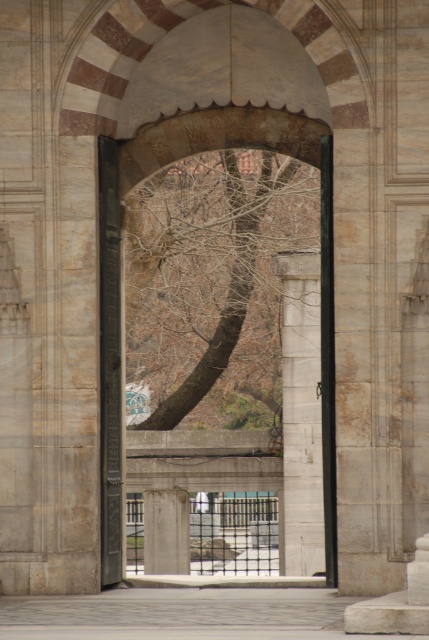
Can you confirm if bare wood tree at center is taller than white stone pillar at center?

Incorrect, bare wood tree at center's height is not larger of white stone pillar at center's.

Based on the photo, between bare wood tree at center and white stone pillar at center, which one has less height?

bare wood tree at center is shorter.

Is point (172, 243) less distant than point (313, 465)?

No, (172, 243) is behind (313, 465).

Where is `bare wood tree at center`? The image size is (429, 640). bare wood tree at center is located at coordinates (211, 275).

Is white stone pillar at center closer to camera compared to white marble pillar at center?

Yes, white stone pillar at center is in front of white marble pillar at center.

Is white stone pillar at center bigger than white marble pillar at center?

Correct, white stone pillar at center is larger in size than white marble pillar at center.

Which is in front, point (304, 296) or point (166, 506)?

Point (304, 296) is more forward.

At what (x,y) coordinates should I click in order to perform the action: click on white stone pillar at center. Please return your answer as a coordinate pair (x, y). The height and width of the screenshot is (640, 429). Looking at the image, I should click on (301, 413).

Does bare wood tree at center have a lesser width compared to white marble pillar at center?

In fact, bare wood tree at center might be wider than white marble pillar at center.

Is bare wood tree at center shorter than white marble pillar at center?

Incorrect, bare wood tree at center's height does not fall short of white marble pillar at center's.

Between point (232, 228) and point (181, 529), which one is positioned in front?

Point (181, 529) is more forward.

Where is `bare wood tree at center`? The image size is (429, 640). bare wood tree at center is located at coordinates (211, 275).